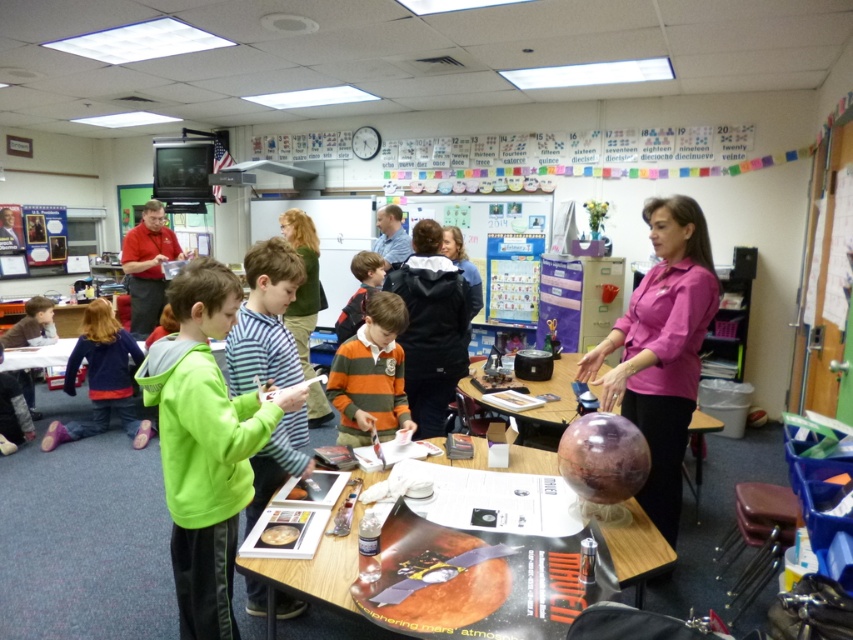
You are a student in the classroom and need to place your green fleece jacket at center on top of the shiny metallic table at center. Is this possible based on their sizes?

The green fleece jacket at center has a greater height compared to the shiny metallic table at center. Since the jacket is taller than the table, placing it on top might not be stable or feasible due to the jacket exceeding the table height.

You are a teacher in the classroom and need to hand out a worksheet to the student wearing the pink matte shirt at center and the student wearing the matte red shirt at left. If the worksheet requires both students to work together, which student should you approach first to ensure they can see each other easily?

The pink matte shirt at center is larger in size than the matte red shirt at left, so you should approach the student wearing the pink matte shirt at center first. Since the pink matte shirt is larger, it might be easier for the student in the matte red shirt at left to see them, ensuring they can collaborate effectively.